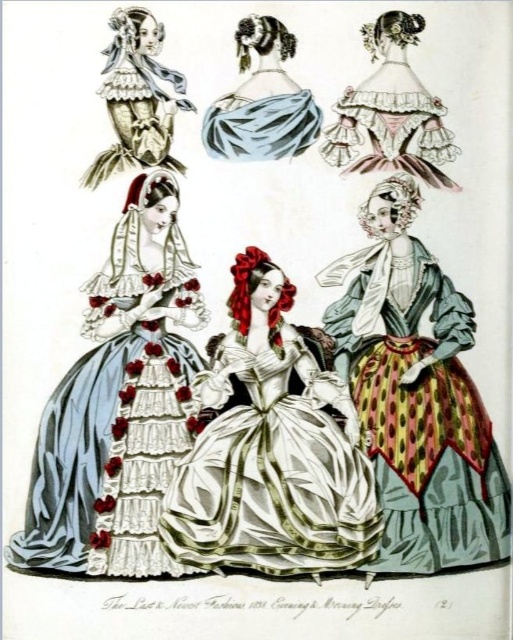
Who is lower down, silk satin dress at center or matte pink fabric dress at upper right?

silk satin dress at center

Between point (279, 365) and point (361, 120), which one is positioned behind?

Positioned behind is point (361, 120).

I want to click on silk satin dress at center, so (271, 451).

Does silk satin gown with ruffles at center appear under polka dot silk skirt at center?

Yes.

Is silk satin gown with ruffles at center taller than polka dot silk skirt at center?

Yes, silk satin gown with ruffles at center is taller than polka dot silk skirt at center.

What do you see at coordinates (120, 404) in the screenshot?
I see `silk satin gown with ruffles at center` at bounding box center [120, 404].

In order to click on silk satin gown with ruffles at center in this screenshot , I will do `click(120, 404)`.

Who is more forward, [464,424] or [175,90]?

Point [464,424]

Does polka dot silk skirt at center have a greater width compared to matte white lace dress at upper left?

Yes, polka dot silk skirt at center is wider than matte white lace dress at upper left.

Is point (477, 436) positioned behind point (126, 20)?

That is False.

Locate an element on the screen. polka dot silk skirt at center is located at coordinates (417, 396).